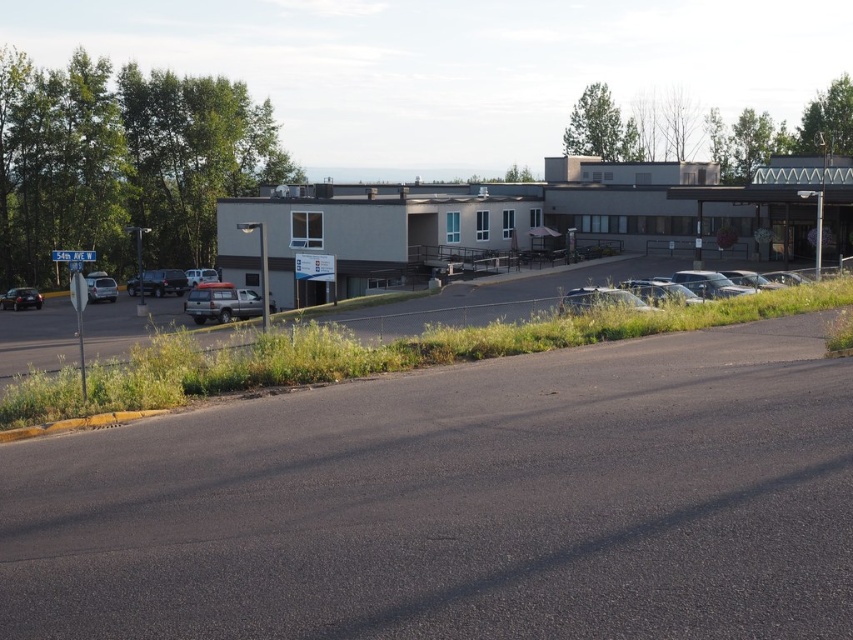
You are a delivery driver who needs to park your truck, which is 2 meters wide, in the parking lot. You see the shiny black suv at left and the matte silver sedan at left. Can you fit your truck between them if the space between them is exactly the width of the wider vehicle?

The matte silver sedan at left is wider than the shiny black suv at left. Since the space between them is exactly the width of the wider vehicle, which is the matte silver sedan at left, the truck that is 2 meters wide can fit if the sedan is at least 2 meters wide. However, without knowing the exact width of the sedan, we cannot confirm for certain.